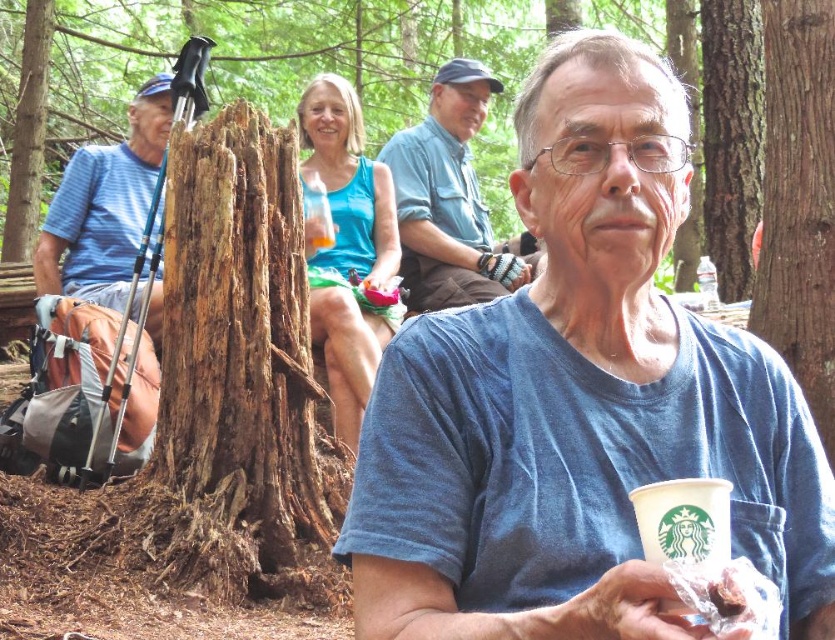
You are standing at the origin point in the image. Which object from the list is exactly at the coordinates point [579,401]?

The blue cotton t shirt at center is exactly at the coordinates point [579,401].

What is the 2D coordinate of the blue fabric tank top at upper center in the image?

The blue fabric tank top at upper center is located at the 2D coordinate point of (348, 250).

You are a photographer trying to capture a photo of the blue fabric tank top at upper center and the blue cotton shirt at center. Since you want both items to appear the same size in the photo, which object should you move closer to the camera?

The blue cotton shirt at center should be moved closer to the camera because it is smaller in size compared to the blue fabric tank top at upper center, so bringing it nearer would balance their sizes in the photo.